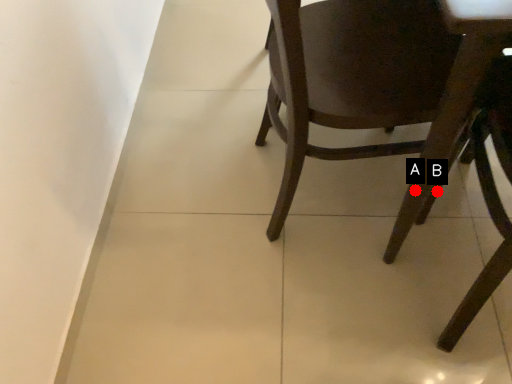
Question: Two points are circled on the image, labeled by A and B beside each circle. Which of the following is the farthest from the observer?

Choices:
 (A) A is further
 (B) B is further

Answer: (B)